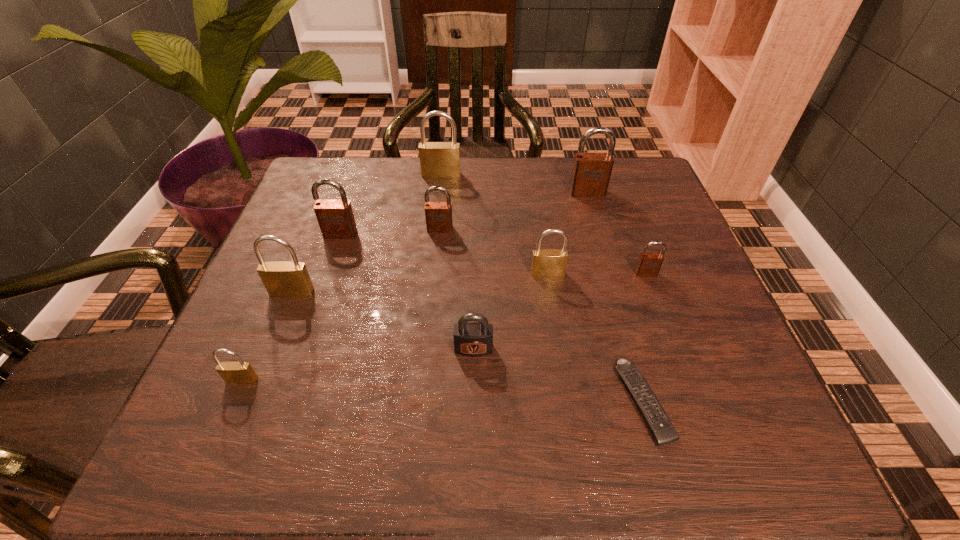
The height and width of the screenshot is (540, 960). Identify the location of vacant region located 0.380m on the front-facing side of the second biggest brown padlock. (289, 387).

Image resolution: width=960 pixels, height=540 pixels. I want to click on free space located 0.290m on the front-facing side of the third biggest brown padlock, so click(x=430, y=334).

You are a GUI agent. You are given a task and a screenshot of the screen. Output one action in this format:
    pyautogui.click(x=<x>, y=<y>)
    Task: Click on the vacant region located on the front-facing side of the third padlock from right to left
    Image resolution: width=960 pixels, height=540 pixels.
    Given the screenshot: What is the action you would take?
    pyautogui.click(x=568, y=415)

Image resolution: width=960 pixels, height=540 pixels. Find the location of `free point located on the front of the fourth padlock from right to left near the keyhole`. free point located on the front of the fourth padlock from right to left near the keyhole is located at coordinates (472, 452).

Where is `vacant area situated 0.060m on the front-facing side of the smallest brass padlock`? Image resolution: width=960 pixels, height=540 pixels. vacant area situated 0.060m on the front-facing side of the smallest brass padlock is located at coordinates point(227,418).

Image resolution: width=960 pixels, height=540 pixels. I want to click on vacant space located on the front-facing side of the rightmost brown padlock, so click(687, 387).

Locate an element on the screen. This screenshot has height=540, width=960. vacant space located 0.100m on the back of the shortest object is located at coordinates (620, 318).

This screenshot has width=960, height=540. I want to click on object that is at the near edge, so click(663, 431).

At what (x,y) coordinates should I click in order to perform the action: click on remote control present at the right edge. Please return your answer as a coordinate pair (x, y). Image resolution: width=960 pixels, height=540 pixels. Looking at the image, I should click on click(x=663, y=431).

I want to click on object located at the far right corner, so click(591, 172).